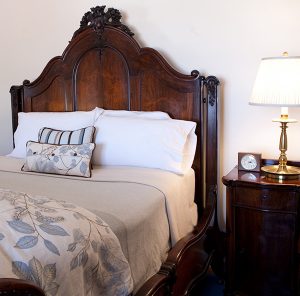
Locate an element on the screen. The image size is (300, 296). dresser is located at coordinates (249, 206).